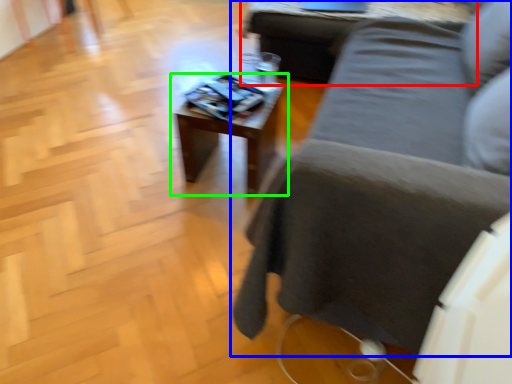
Question: Which is farther away from table (highlighted by a red box)? studio couch (highlighted by a blue box) or table (highlighted by a green box)?

Choices:
 (A) studio couch
 (B) table

Answer: (A)